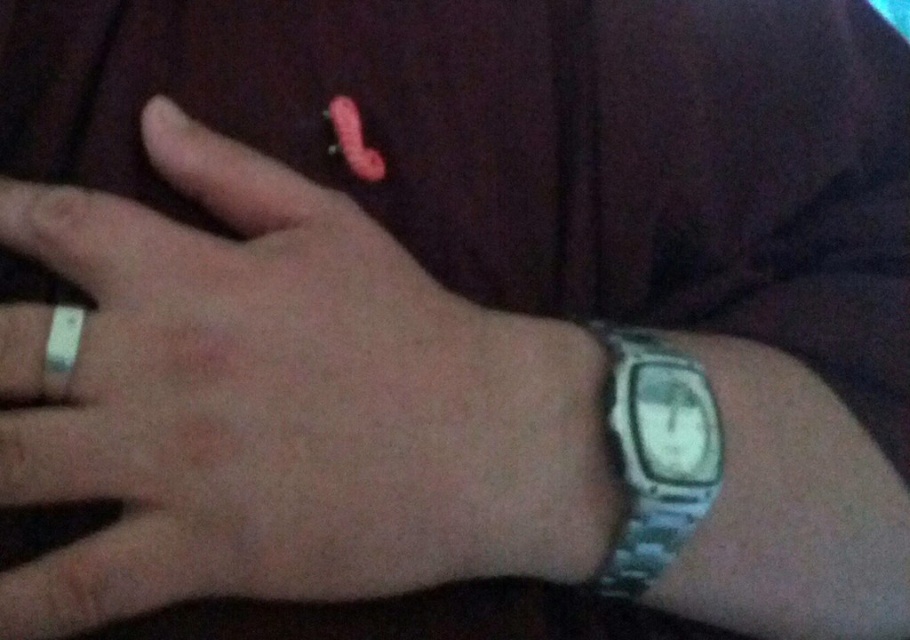
You are a photographer adjusting your camera settings to capture a closeup of the metallic watch at right. The camera lens is currently 12 inches away from the watch. Should you move the camera closer or farther away to ensure the watch fills the frame appropriately?

The metallic watch at right is 12.33 inches from the viewer. Since the camera lens is currently at 12 inches, you should move the camera slightly farther away to match the 12.33 inches distance for proper framing.

You are an interior designer working on a project that requires precise measurements. You need to place a decorative item exactly at the center of the image. The metallic watch at right is positioned at coordinates 0.634 on the x and 0.316 on the y. Is the watch centrally located in the image?

The metallic watch at right is located at point (x=287, y=404). Since the center of the image would be at coordinates (x=455, y=320), the watch is not centrally located as its x and y coordinates are both higher than 0.5.

You are a jeweler examining a customer who has two watches on their right wrist. The watches are labeled as the metallic watch at right and the metallic silver watch at right. Which one is positioned to the left?

The metallic watch at right is positioned to the left of the metallic silver watch at right.